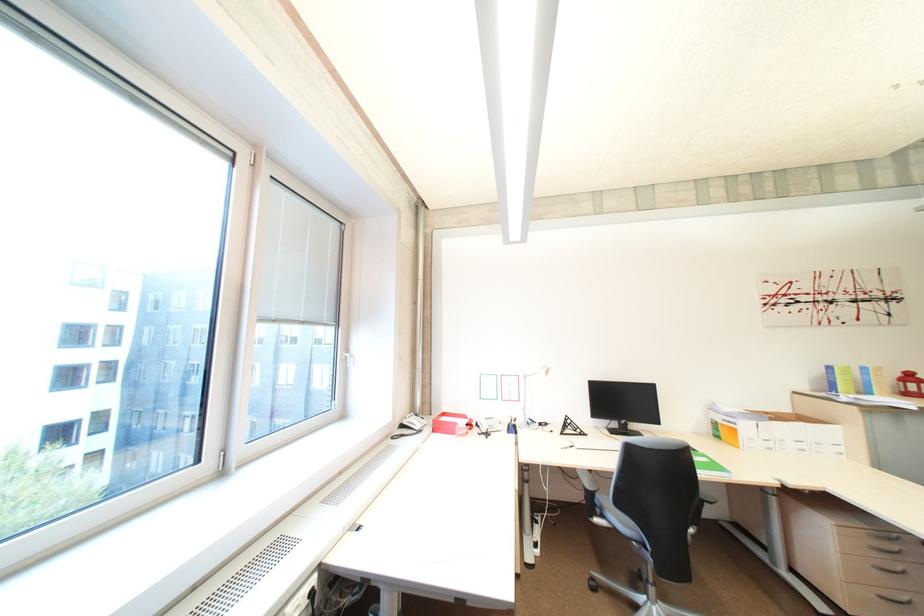
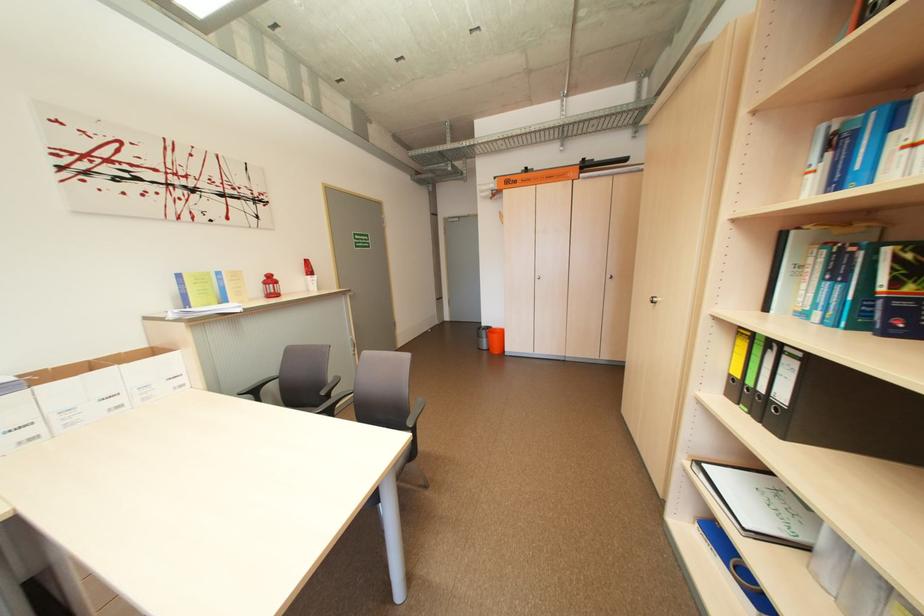
Where in the second image is the point corresponding to point (810, 419) from the first image?

(163, 353)